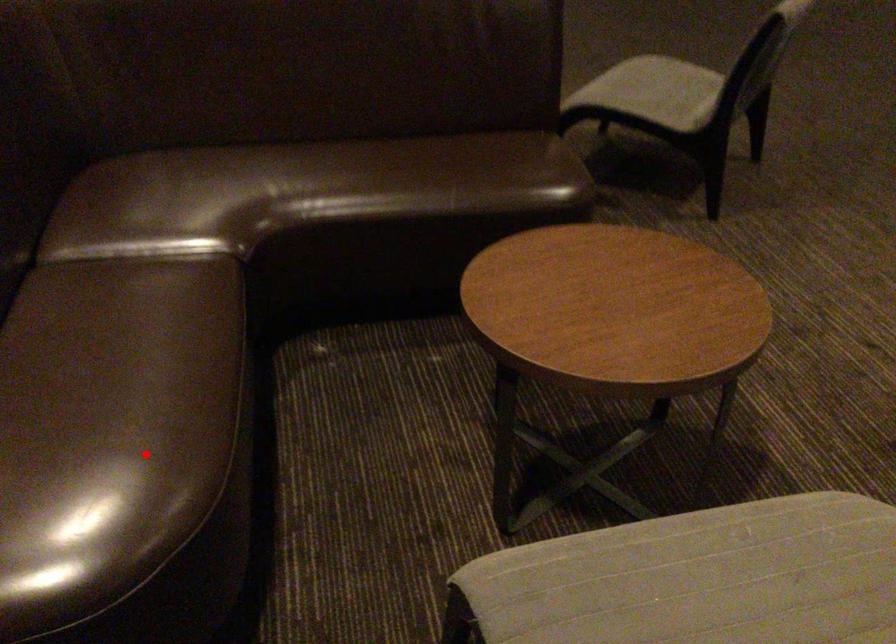
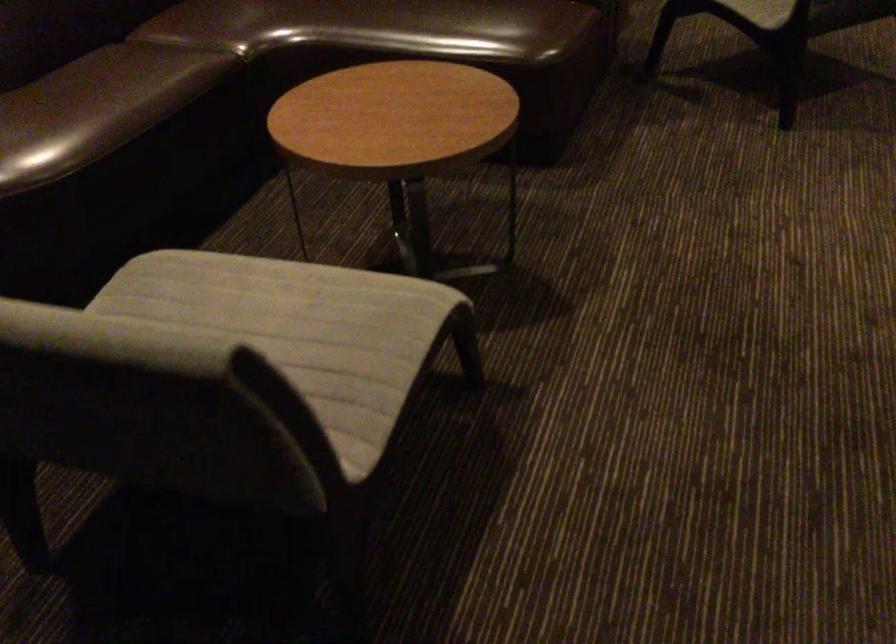
Question: I am providing you with two images of the same scene from different viewpoints. Given a red point in image1, look at the same physical point in image2. Is it:

Choices:
 (A) Closer to the viewpoint
 (B) Farther from the viewpoint

Answer: (B)